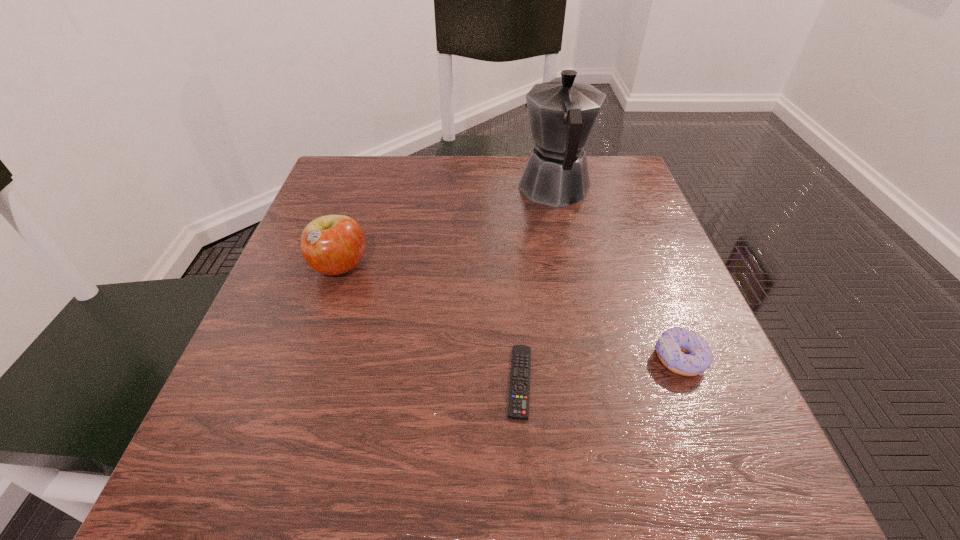
The image size is (960, 540). Find the location of `unoccupied position between the doughnut and the third object from right to left`. unoccupied position between the doughnut and the third object from right to left is located at coordinates (600, 370).

Identify the location of empty space that is in between the apple and the remote control. The image size is (960, 540). tap(430, 325).

Find the location of `vacant area that lies between the remote control and the coffeepot`. vacant area that lies between the remote control and the coffeepot is located at coordinates (538, 285).

Identify which object is the nearest to the second object from left to right. Please provide its 2D coordinates. Your answer should be formatted as a tuple, i.e. [(x, y)], where the tuple contains the x and y coordinates of a point satisfying the conditions above.

[(670, 347)]

Locate which object ranks third in proximity to the second shortest object. Please provide its 2D coordinates. Your answer should be formatted as a tuple, i.e. [(x, y)], where the tuple contains the x and y coordinates of a point satisfying the conditions above.

[(332, 244)]